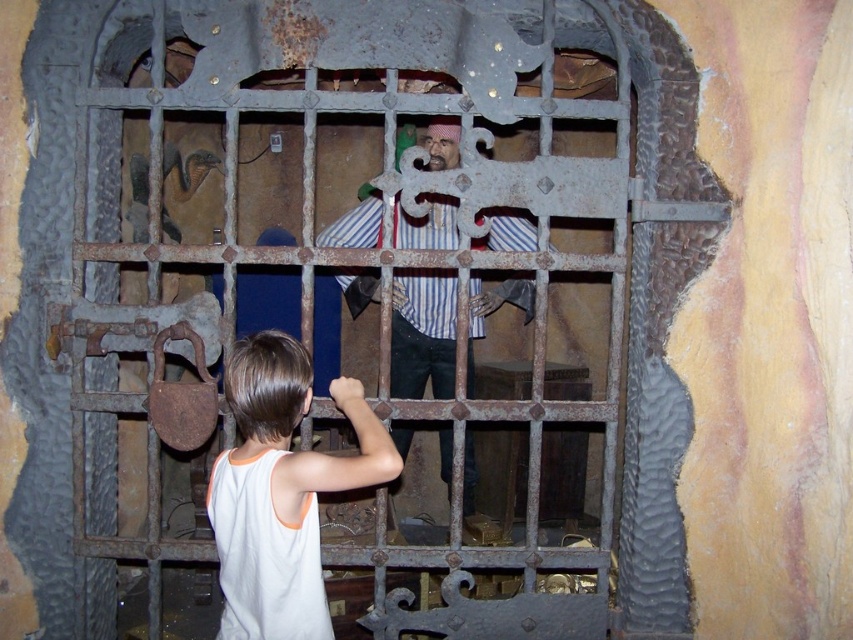
Is point (340, 468) positioned before point (375, 225)?

Yes, it is.

Does white cotton tank top at lower left appear over striped fabric pirate at center?

Actually, white cotton tank top at lower left is below striped fabric pirate at center.

Locate an element on the screen. The image size is (853, 640). white cotton tank top at lower left is located at coordinates (281, 490).